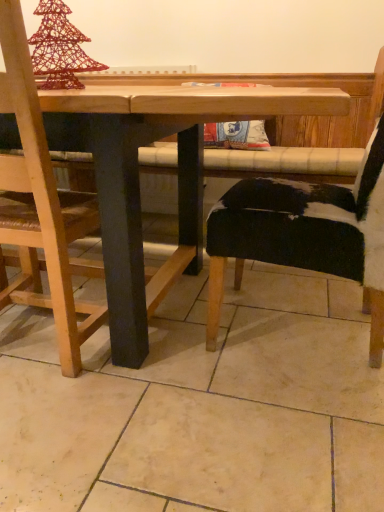
This screenshot has width=384, height=512. What do you see at coordinates (41, 207) in the screenshot?
I see `wooden chair at left, which is the first chair in left-to-right order` at bounding box center [41, 207].

Identify the location of wooden table at center. (139, 177).

Where is `wooden chair at left, which is the first chair in left-to-right order`? This screenshot has height=512, width=384. wooden chair at left, which is the first chair in left-to-right order is located at coordinates (41, 207).

Is wooden chair at left, the 2th chair viewed from the right, touching black cowhide chair at right, the second chair in the left-to-right sequence?

No, wooden chair at left, the 2th chair viewed from the right, is not touching black cowhide chair at right, the second chair in the left-to-right sequence.

Looking at this image, does wooden chair at left, the 2th chair viewed from the right, turn towards black cowhide chair at right, the second chair in the left-to-right sequence?

No, wooden chair at left, the 2th chair viewed from the right, is not facing towards black cowhide chair at right, the second chair in the left-to-right sequence.

Which is in front, point (61, 265) or point (313, 213)?

The point (61, 265) is closer.

In the image, is black cowhide chair at right, the second chair in the left-to-right sequence, on the left side or the right side of wooden chair at left, which is the first chair in left-to-right order?

Based on their positions, black cowhide chair at right, the second chair in the left-to-right sequence, is located to the right of wooden chair at left, which is the first chair in left-to-right order.

Is black cowhide chair at right, which is counted as the first chair, starting from the right, wider than wooden chair at left, which is the first chair in left-to-right order?

Indeed, black cowhide chair at right, which is counted as the first chair, starting from the right, has a greater width compared to wooden chair at left, which is the first chair in left-to-right order.

Which of these two, black cowhide chair at right, the second chair in the left-to-right sequence, or wooden chair at left, which is the first chair in left-to-right order, stands shorter?

wooden chair at left, which is the first chair in left-to-right order.

Is black cowhide chair at right, the second chair in the left-to-right sequence, next to wooden chair at left, which is the first chair in left-to-right order?

black cowhide chair at right, the second chair in the left-to-right sequence, is not next to wooden chair at left, which is the first chair in left-to-right order, and they're not touching.

Is wooden table at center next to wooden chair at left, which is the first chair in left-to-right order, and touching it?

wooden table at center and wooden chair at left, which is the first chair in left-to-right order, are clearly separated.

Considering the relative positions of wooden table at center and wooden chair at left, the 2th chair viewed from the right, in the image provided, is wooden table at center to the left of wooden chair at left, the 2th chair viewed from the right, from the viewer's perspective?

No.

Could you measure the distance between wooden table at center and wooden chair at left, which is the first chair in left-to-right order?

wooden table at center is 9.87 inches away from wooden chair at left, which is the first chair in left-to-right order.

Is wooden table at center oriented towards wooden chair at left, which is the first chair in left-to-right order?

Yes.

Is wooden table at center located within wooden chair at left, the 2th chair viewed from the right?

No, wooden table at center is not inside wooden chair at left, the 2th chair viewed from the right.

Is wooden chair at left, which is the first chair in left-to-right order, in front of or behind wooden table at center in the image?

wooden chair at left, which is the first chair in left-to-right order, is positioned farther from the viewer than wooden table at center.

Considering the sizes of objects wooden chair at left, the 2th chair viewed from the right, and wooden table at center in the image provided, who is thinner, wooden chair at left, the 2th chair viewed from the right, or wooden table at center?

Thinner between the two is wooden chair at left, the 2th chair viewed from the right.

Is point (250, 106) positioned before point (255, 204)?

Yes, point (250, 106) is closer to viewer.

Is wooden table at center next to black cowhide chair at right, which is counted as the first chair, starting from the right, and touching it?

No.

Could black cowhide chair at right, which is counted as the first chair, starting from the right, be considered to be inside wooden table at center?

Yes, wooden table at center is surrounding black cowhide chair at right, which is counted as the first chair, starting from the right.

Can you confirm if wooden table at center is bigger than black cowhide chair at right, the second chair in the left-to-right sequence?

Yes.

In the scene shown: Is black cowhide chair at right, the second chair in the left-to-right sequence, to the left of wooden table at center from the viewer's perspective?

No, black cowhide chair at right, the second chair in the left-to-right sequence, is not to the left of wooden table at center.

Would you say black cowhide chair at right, which is counted as the first chair, starting from the right, is inside or outside wooden table at center?

black cowhide chair at right, which is counted as the first chair, starting from the right, is located inside wooden table at center.

Is black cowhide chair at right, the second chair in the left-to-right sequence, bigger than wooden table at center?

Incorrect, black cowhide chair at right, the second chair in the left-to-right sequence, is not larger than wooden table at center.

Is black cowhide chair at right, which is counted as the first chair, starting from the right, positioned behind wooden table at center?

Yes, black cowhide chair at right, which is counted as the first chair, starting from the right, is further from the viewer.

The height and width of the screenshot is (512, 384). In the image, there is a black cowhide chair at right, the second chair in the left-to-right sequence. In order to click on chair below it (from the image's perspective) in this screenshot , I will do `click(41, 207)`.

Image resolution: width=384 pixels, height=512 pixels. Identify the location of chair behind the wooden chair at left, the 2th chair viewed from the right. (305, 233).

Looking at this image, looking at the image, which one is located closer to black cowhide chair at right, the second chair in the left-to-right sequence, wooden table at center or wooden chair at left, which is the first chair in left-to-right order?

wooden table at center lies closer to black cowhide chair at right, the second chair in the left-to-right sequence, than the other object.

When comparing their distances from wooden chair at left, the 2th chair viewed from the right, does wooden table at center or black cowhide chair at right, which is counted as the first chair, starting from the right, seem further?

black cowhide chair at right, which is counted as the first chair, starting from the right, is positioned further to the anchor wooden chair at left, the 2th chair viewed from the right.

Based on their spatial positions, is wooden chair at left, which is the first chair in left-to-right order, or black cowhide chair at right, the second chair in the left-to-right sequence, closer to wooden table at center?

Among the two, wooden chair at left, which is the first chair in left-to-right order, is located nearer to wooden table at center.

From the image, which object appears to be farther from wooden chair at left, which is the first chair in left-to-right order, black cowhide chair at right, the second chair in the left-to-right sequence, or wooden table at center?

black cowhide chair at right, the second chair in the left-to-right sequence, is further to wooden chair at left, which is the first chair in left-to-right order.

When comparing their distances from wooden table at center, does black cowhide chair at right, which is counted as the first chair, starting from the right, or wooden chair at left, the 2th chair viewed from the right, seem closer?

wooden chair at left, the 2th chair viewed from the right, is positioned closer to the anchor wooden table at center.

From the image, which object appears to be farther from black cowhide chair at right, which is counted as the first chair, starting from the right, wooden chair at left, the 2th chair viewed from the right, or wooden table at center?

wooden chair at left, the 2th chair viewed from the right, lies further to black cowhide chair at right, which is counted as the first chair, starting from the right, than the other object.

The image size is (384, 512). What are the coordinates of `table situated between wooden chair at left, the 2th chair viewed from the right, and black cowhide chair at right, the second chair in the left-to-right sequence, from left to right` in the screenshot? It's located at (139, 177).